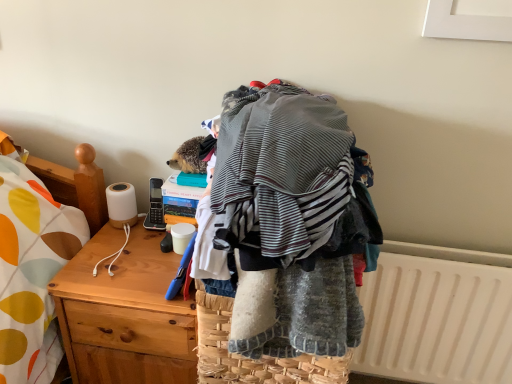
Question: Is wooden desk at left completely or partially outside of woven straw picnic basket at center?

Choices:
 (A) no
 (B) yes

Answer: (B)

Question: From a real-world perspective, does wooden desk at left sit lower than woven straw picnic basket at center?

Choices:
 (A) yes
 (B) no

Answer: (A)

Question: Considering the relative sizes of wooden desk at left and woven straw picnic basket at center in the image provided, is wooden desk at left smaller than woven straw picnic basket at center?

Choices:
 (A) yes
 (B) no

Answer: (B)

Question: From the image's perspective, does wooden desk at left appear higher than woven straw picnic basket at center?

Choices:
 (A) no
 (B) yes

Answer: (A)

Question: Does wooden desk at left have a lesser height compared to woven straw picnic basket at center?

Choices:
 (A) no
 (B) yes

Answer: (A)

Question: Would you say woven straw picnic basket at center is part of wooden desk at left's contents?

Choices:
 (A) yes
 (B) no

Answer: (B)

Question: From the image's perspective, is wooden desk at left located above white plastic radiator at lower right?

Choices:
 (A) yes
 (B) no

Answer: (B)

Question: Can you confirm if wooden desk at left is positioned to the right of white plastic radiator at lower right?

Choices:
 (A) no
 (B) yes

Answer: (A)

Question: Are wooden desk at left and white plastic radiator at lower right making contact?

Choices:
 (A) yes
 (B) no

Answer: (B)

Question: Is wooden desk at left bigger than white plastic radiator at lower right?

Choices:
 (A) yes
 (B) no

Answer: (A)

Question: Could you tell me if wooden desk at left is facing white plastic radiator at lower right?

Choices:
 (A) no
 (B) yes

Answer: (A)

Question: Is white plastic radiator at lower right at the back of wooden desk at left?

Choices:
 (A) no
 (B) yes

Answer: (A)

Question: Can you confirm if woven straw picnic basket at center is wider than white plastic radiator at lower right?

Choices:
 (A) no
 (B) yes

Answer: (B)